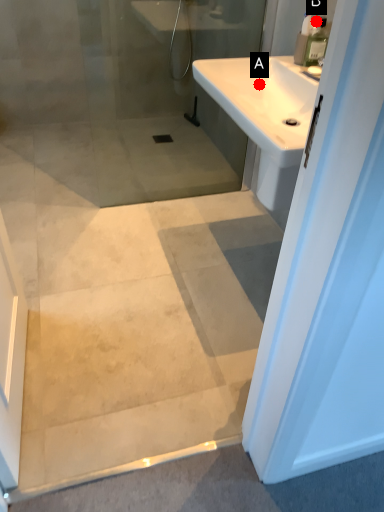
Question: Two points are circled on the image, labeled by A and B beside each circle. Which point is closer to the camera taking this photo?

Choices:
 (A) A is closer
 (B) B is closer

Answer: (B)